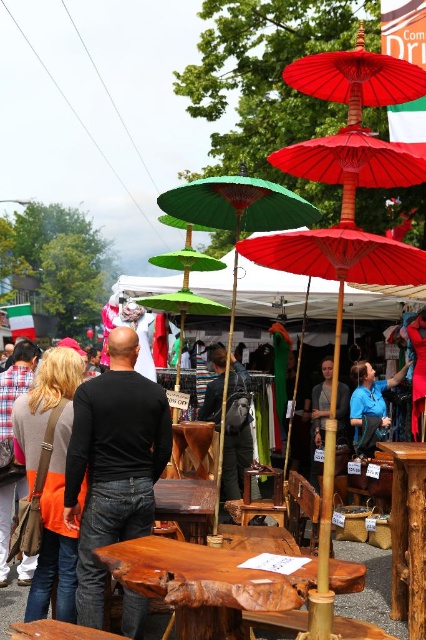
You are a customer at the market stall and want to pick up both the orange fabric bag at lower left and the black fabric dress at center. Which item should you reach for first to grab the one closer to you?

The orange fabric bag at lower left is closer to the viewer than the black fabric dress at center, so you should reach for the orange fabric bag at lower left first.